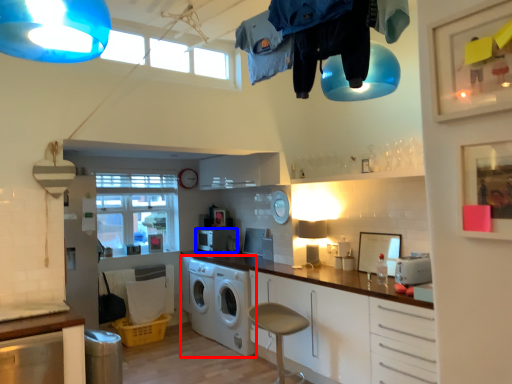
Question: Among these objects, which one is farthest to the camera, washing machine (highlighted by a red box) or appliance (highlighted by a blue box)?

Choices:
 (A) washing machine
 (B) appliance

Answer: (B)